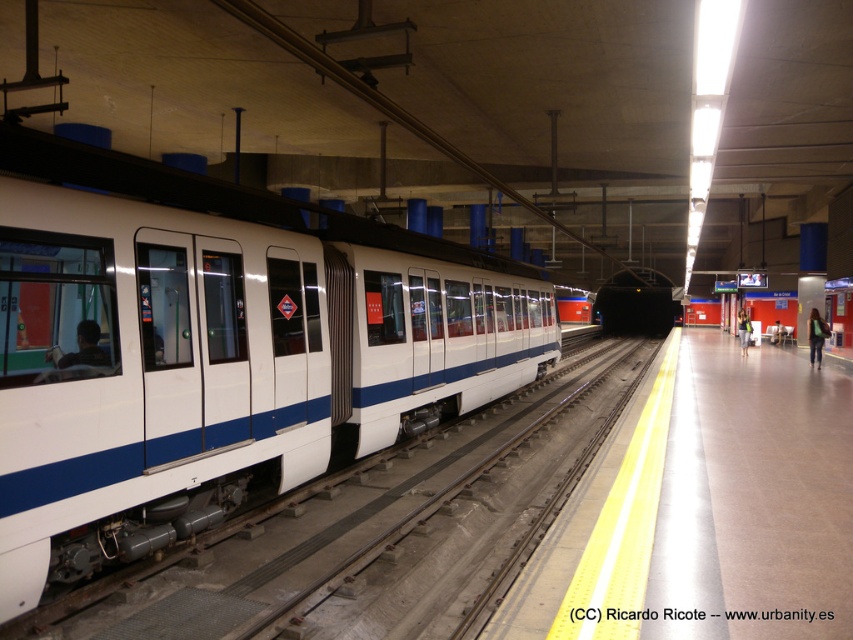
Question: Does green fabric bag at right lie in front of denim jacket at right?

Choices:
 (A) no
 (B) yes

Answer: (B)

Question: Which object is positioned farthest from the white glossy train at left?

Choices:
 (A) green fabric bag at right
 (B) denim jacket at right

Answer: (B)

Question: Is green fabric bag at right smaller than denim jacket at right?

Choices:
 (A) yes
 (B) no

Answer: (A)

Question: Does white glossy train at left come in front of green fabric bag at right?

Choices:
 (A) yes
 (B) no

Answer: (A)

Question: Considering the real-world distances, which object is closest to the white glossy train at left?

Choices:
 (A) green fabric bag at right
 (B) denim jacket at right

Answer: (A)

Question: Which object is farther from the camera taking this photo?

Choices:
 (A) denim jacket at right
 (B) green fabric bag at right
 (C) white glossy train at left

Answer: (A)